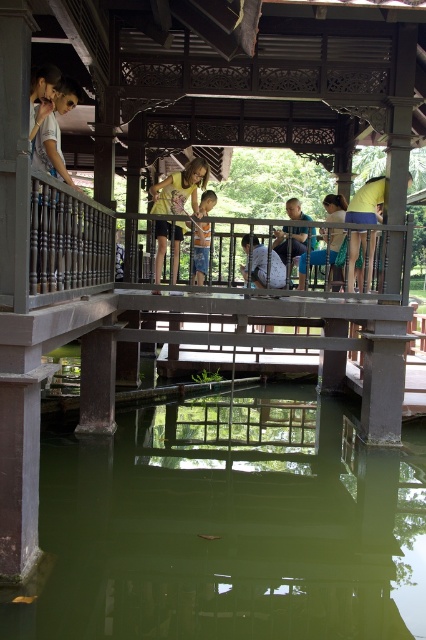
From the picture: Which of these two, green translucent water at center or blue denim shorts at center, stands shorter?

With less height is green translucent water at center.

I want to click on green translucent water at center, so click(x=229, y=525).

Can you confirm if green translucent water at center is positioned to the left of yellow matte shirt at center?

In fact, green translucent water at center is to the right of yellow matte shirt at center.

Is point (25, 624) farther from camera compared to point (157, 257)?

No, it is in front of (157, 257).

Find the location of a particular element. The image size is (426, 640). green translucent water at center is located at coordinates (229, 525).

Is yellow matte shirt at center closer to the viewer compared to light brown fabric shirt at upper left?

No, yellow matte shirt at center is further to the viewer.

Does yellow matte shirt at center lie behind light brown fabric shirt at upper left?

Yes.

Who is more forward, (x=158, y=237) or (x=54, y=90)?

Point (x=54, y=90) is in front.

The image size is (426, 640). I want to click on yellow matte shirt at center, so click(x=180, y=188).